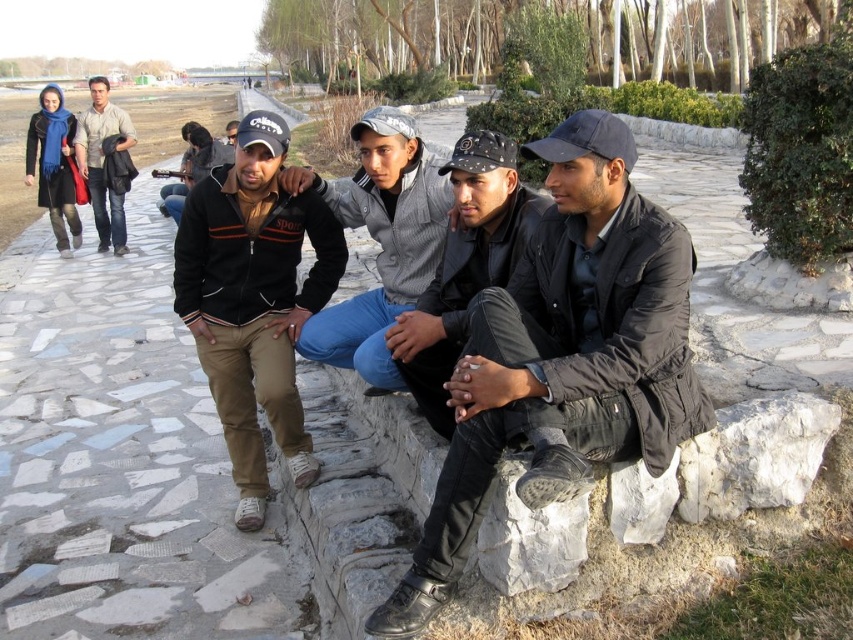
Does point (583, 154) lie in front of point (461, 305)?

Yes, it is.

Consider the image. Can you confirm if dark gray leather jacket at center is positioned above black leather jacket at center?

No.

Does point (518, 278) lie in front of point (451, 225)?

Yes, point (518, 278) is closer to viewer.

Where is `dark gray leather jacket at center`? The width and height of the screenshot is (853, 640). dark gray leather jacket at center is located at coordinates (563, 356).

At what (x,y) coordinates should I click in order to perform the action: click on gray knit sweater at center. Please return your answer as a coordinate pair (x, y). Looking at the image, I should click on (379, 241).

Can you confirm if gray knit sweater at center is thinner than matte beige jacket at upper left?

Indeed, gray knit sweater at center has a lesser width compared to matte beige jacket at upper left.

Locate an element on the screen. gray knit sweater at center is located at coordinates pos(379,241).

The image size is (853, 640). Identify the location of black leather jacket at center. (463, 266).

Who is lower down, black leather jacket at center or matte beige jacket at upper left?

Positioned lower is black leather jacket at center.

Is point (460, 163) positioned before point (99, 145)?

Yes.

What are the coordinates of `black leather jacket at center` in the screenshot? It's located at (463, 266).